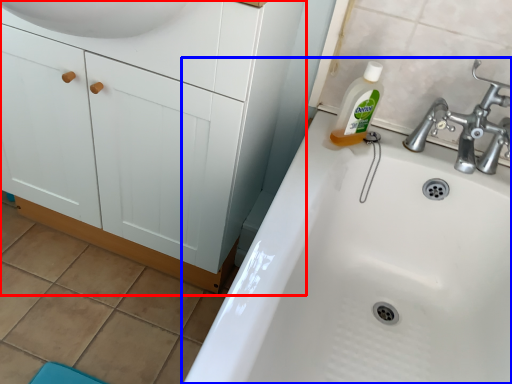
Question: Which point is closer to the camera, bathroom cabinet (highlighted by a red box) or sink (highlighted by a blue box)?

Choices:
 (A) bathroom cabinet
 (B) sink

Answer: (B)